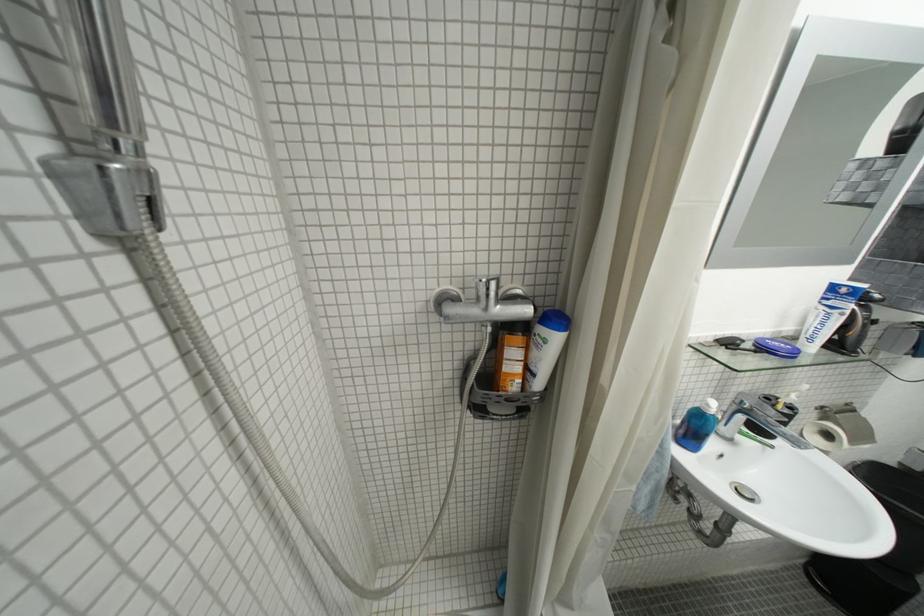
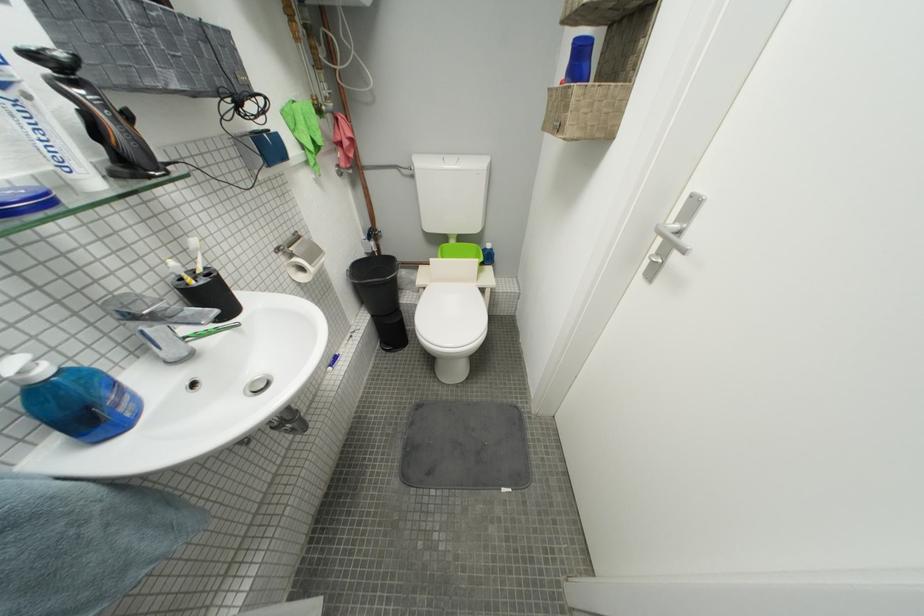
In the second image, find the point that corresponds to pixel 876 321 in the first image.

(114, 108)